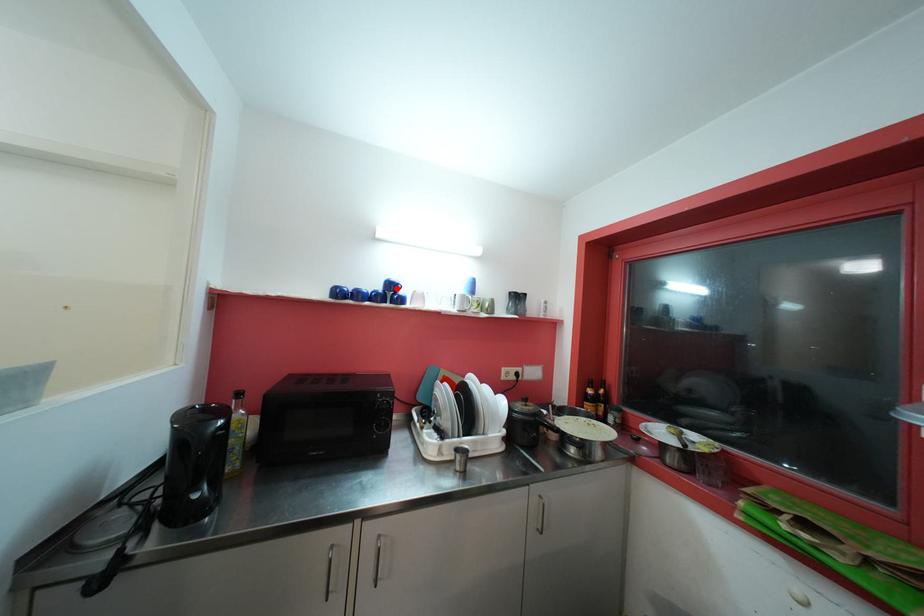
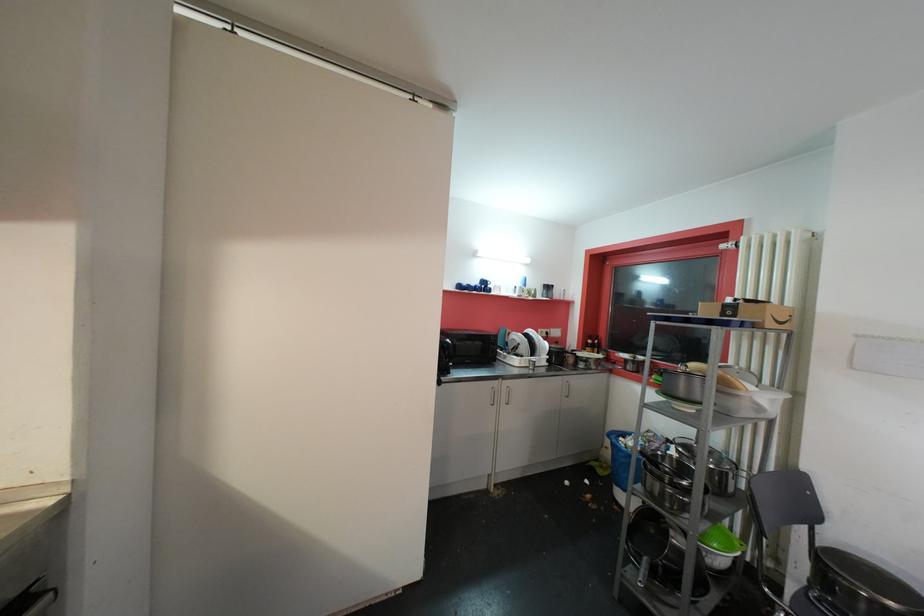
Where in the second image is the point corresponding to the highlighted location from the first image?

(489, 285)